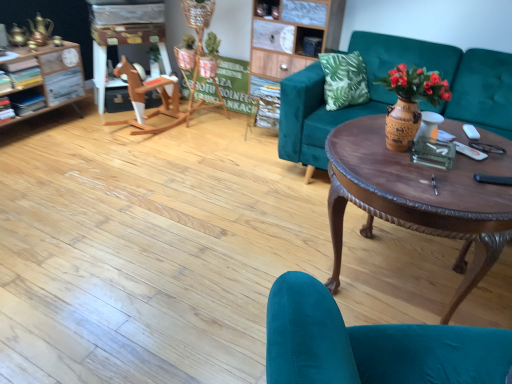
This screenshot has height=384, width=512. What are the coordinates of `vacant space that is to the left of wooden vase with flowers at center` in the screenshot? It's located at (349, 142).